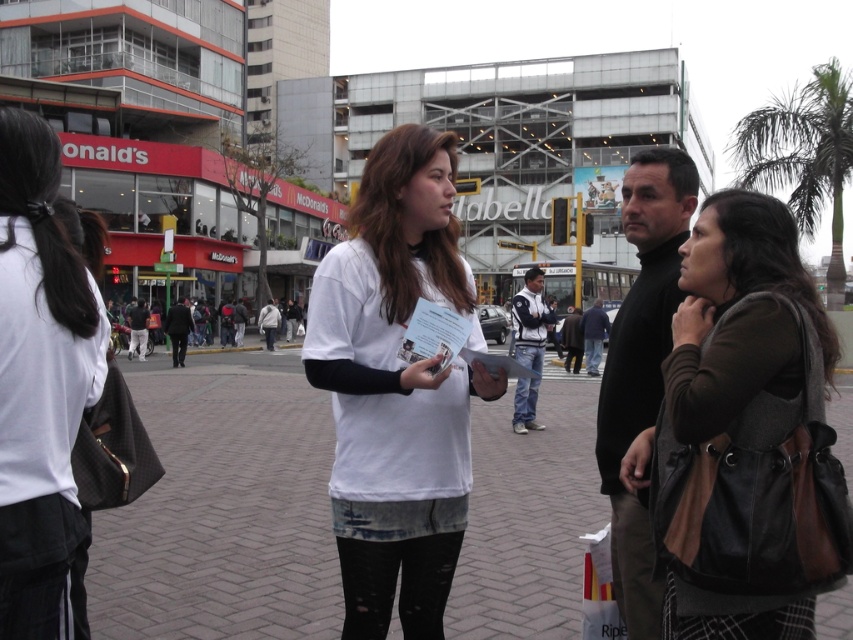
Between black turtleneck sweater at center and white fleece jacket at center, which one is positioned higher?

Positioned higher is white fleece jacket at center.

Image resolution: width=853 pixels, height=640 pixels. Find the location of `black turtleneck sweater at center`. black turtleneck sweater at center is located at coordinates (641, 365).

You are a GUI agent. You are given a task and a screenshot of the screen. Output one action in this format:
    pyautogui.click(x=<x>, y=<y>)
    Task: Click on the black turtleneck sweater at center
    Image resolution: width=853 pixels, height=640 pixels.
    Given the screenshot: What is the action you would take?
    pyautogui.click(x=641, y=365)

Is dark gray coat at center closer to the viewer compared to white cotton jacket at center?

Yes, it is.

Which is in front, point (187, 312) or point (274, 323)?

Positioned in front is point (187, 312).

This screenshot has height=640, width=853. I want to click on dark gray coat at center, so click(178, 330).

Does white cotton shirt at center have a lesser height compared to black turtleneck sweater at center?

Indeed, white cotton shirt at center has a lesser height compared to black turtleneck sweater at center.

Can you confirm if white cotton shirt at center is positioned above black turtleneck sweater at center?

No.

Who is more distant from viewer, [419,484] or [669,148]?

Positioned behind is point [669,148].

I want to click on white cotton shirt at center, so click(396, 387).